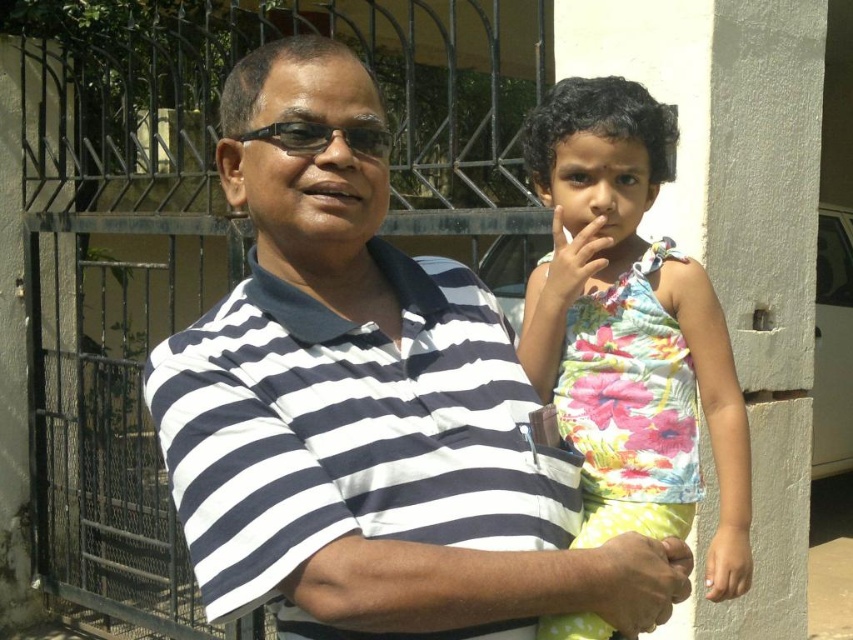
You are a photographer standing 5 feet away from the white striped shirt at center. Can you take a clear photo of it without moving closer?

The white striped shirt at center is 3.98 feet away from the camera, so yes, you can take a clear photo without moving closer since you are only 5 feet away, which is within a reasonable distance for clarity.

You are a photographer trying to capture a candid shot of the scene. You notice the white striped shirt at center and the black plastic glasses at center. Which object should you focus on first if you want to capture the one closer to the left side?

The black plastic glasses at center is to the left of the white striped shirt at center, so focusing on the black plastic glasses at center first would capture the object closer to the left side.

You are a photographer trying to capture a closeup shot of the black plastic glasses at center while keeping the floral fabric dress at center in the background. Your camera has a minimum focusing distance of 24 inches. Can you achieve this shot without moving either object?

The distance between the floral fabric dress at center and black plastic glasses at center is 24.34 inches. Since the minimum focusing distance is 24 inches, you can achieve the closeup shot while keeping the floral fabric dress in the background as the distance is sufficient.